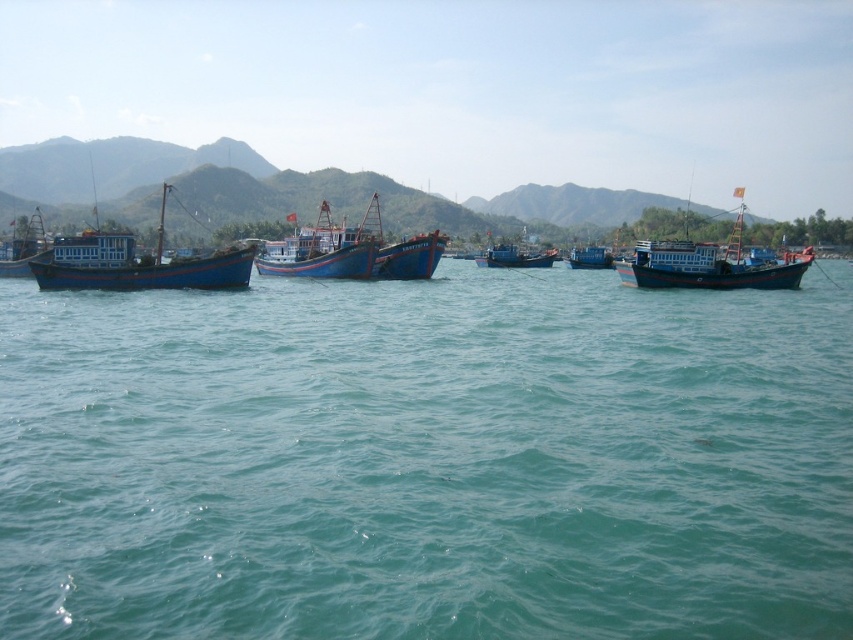
Which is in front, point (119, 268) or point (590, 252)?

Point (119, 268) is in front.

Can you confirm if blue wooden boat at left is smaller than blue painted wooden boat at center?

Indeed, blue wooden boat at left has a smaller size compared to blue painted wooden boat at center.

Which is in front, point (134, 260) or point (585, 252)?

Point (134, 260) is in front.

This screenshot has width=853, height=640. What are the coordinates of `blue wooden boat at left` in the screenshot? It's located at tap(137, 262).

Is blue wooden boat at left taller than blue wooden boat at right?

Incorrect, blue wooden boat at left's height is not larger of blue wooden boat at right's.

Does blue wooden boat at left appear on the right side of blue wooden boat at right?

Incorrect, blue wooden boat at left is not on the right side of blue wooden boat at right.

Between point (78, 276) and point (703, 243), which one is positioned in front?

Positioned in front is point (78, 276).

At what (x,y) coordinates should I click in order to perform the action: click on blue wooden boat at left. Please return your answer as a coordinate pair (x, y). The width and height of the screenshot is (853, 640). Looking at the image, I should click on (137, 262).

Between point (785, 259) and point (415, 250), which one is positioned behind?

Positioned behind is point (415, 250).

Which of these two, blue wooden boat at right or blue matte boat at center, stands shorter?

Standing shorter between the two is blue matte boat at center.

Is point (688, 200) positioned before point (447, 237)?

No, (688, 200) is behind (447, 237).

Locate an element on the screen. blue wooden boat at right is located at coordinates (711, 262).